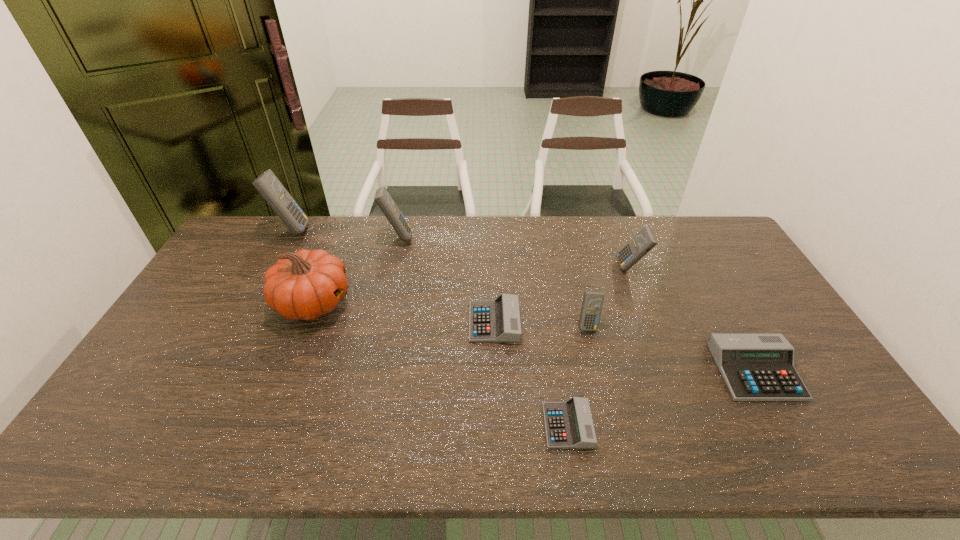
Identify the location of the biggest gray calculator. (755, 367).

Identify the location of the rightmost gray calculator. click(x=755, y=367).

The height and width of the screenshot is (540, 960). I want to click on the second smallest gray calculator, so click(498, 320).

At what (x,y) coordinates should I click in order to perform the action: click on the sixth tallest calculator. Please return your answer as a coordinate pair (x, y). The image size is (960, 540). Looking at the image, I should click on (498, 320).

Image resolution: width=960 pixels, height=540 pixels. In order to click on the smallest gray calculator in this screenshot , I will do `click(569, 424)`.

Image resolution: width=960 pixels, height=540 pixels. What are the coordinates of `the nearest gray calculator` in the screenshot? It's located at (569, 424).

Locate an element on the screen. This screenshot has width=960, height=540. vacant space located on the front-facing side of the leftmost calculator is located at coordinates coord(398,230).

Locate an element on the screen. Image resolution: width=960 pixels, height=540 pixels. vacant space located 0.100m on the front-facing side of the second tallest calculator is located at coordinates (440, 237).

Find the location of a particular element. The height and width of the screenshot is (540, 960). vacant space located 0.370m on the face of the pumpkin is located at coordinates [471, 303].

Locate an element on the screen. free region located on the front-facing side of the fifth shortest object is located at coordinates (593, 267).